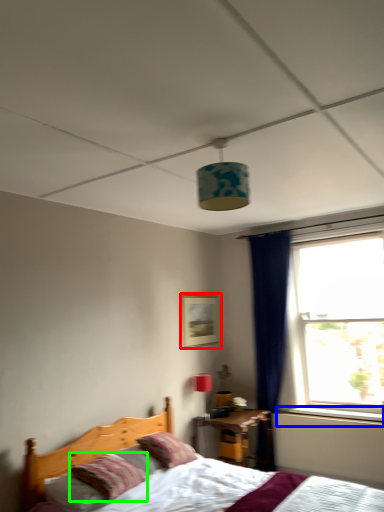
Question: Which object is the closest to the picture frame (highlighted by a red box)? Choose among these: window sill (highlighted by a blue box) or pillow (highlighted by a green box).

Choices:
 (A) window sill
 (B) pillow

Answer: (A)